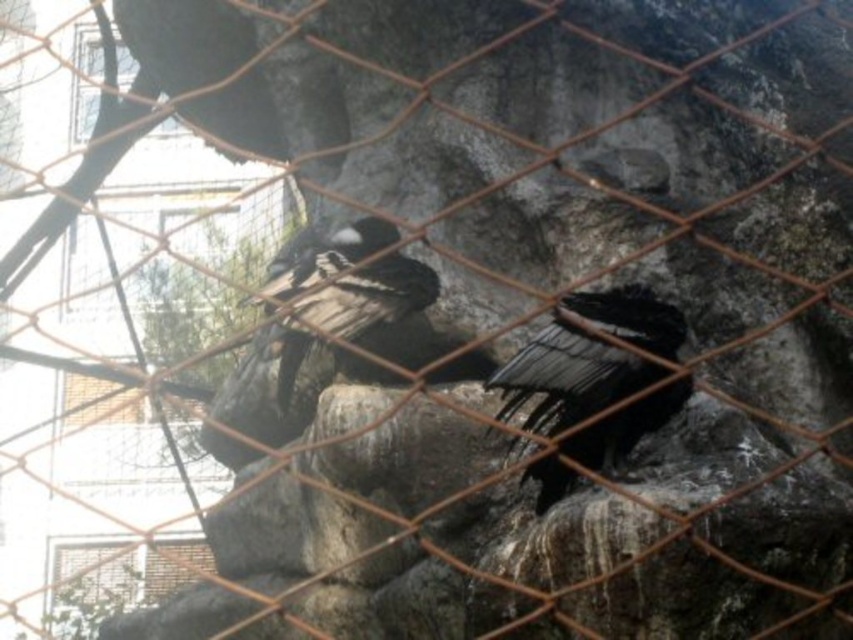
Based on the photo, you are a zookeeper observing the enclosure. You notice the black feathered bird at center and the shiny black feathers at center. Which object is positioned higher in the image?

The shiny black feathers at center are positioned higher than the black feathered bird at center.

You are a zookeeper observing the enclosure. You notice the black feathered bird at center and the shiny black feathers at center. Which object is located to the left of the other?

The shiny black feathers at center are located to the left of the black feathered bird at center.